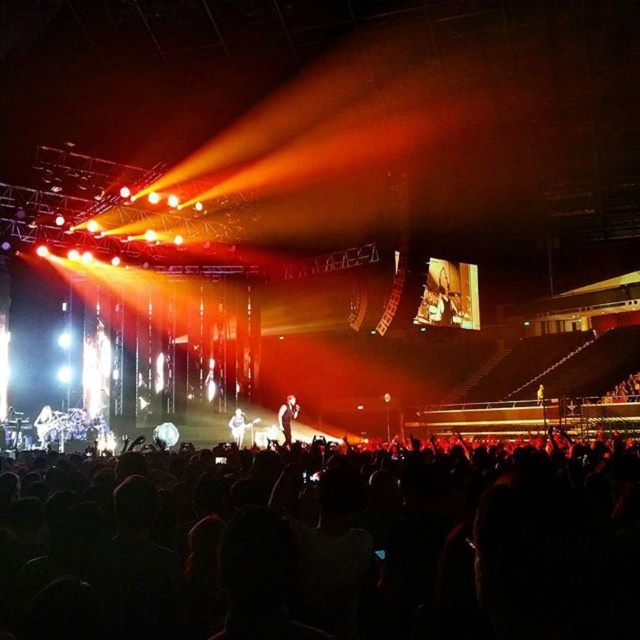
Between black matte crowd at lower center and yellow fabric person at center, which one is positioned lower?

Positioned lower is black matte crowd at lower center.

Is black matte crowd at lower center taller than yellow fabric person at center?

Yes, black matte crowd at lower center is taller than yellow fabric person at center.

Between point (204, 548) and point (538, 401), which one is positioned in front?

Positioned in front is point (204, 548).

You are a GUI agent. You are given a task and a screenshot of the screen. Output one action in this format:
    pyautogui.click(x=<x>, y=<y>)
    Task: Click on the black matte crowd at lower center
    This screenshot has height=640, width=640.
    Given the screenshot: What is the action you would take?
    pyautogui.click(x=323, y=547)

Does point (241, 424) come in front of point (540, 385)?

Yes.

What do you see at coordinates (240, 426) in the screenshot?
I see `white fabric shirt at center` at bounding box center [240, 426].

Identify the location of white fabric shirt at center. (240, 426).

Find the location of a particular element. This screenshot has width=640, height=640. white fabric shirt at center is located at coordinates (240, 426).

Who is more distant from viewer, (285, 422) or (538, 401)?

Point (538, 401)

Is black leather jacket at center wider than yellow fabric person at center?

No.

Based on the photo, who is more forward, (x=285, y=442) or (x=538, y=388)?

Positioned in front is point (x=285, y=442).

In order to click on black leather jacket at center in this screenshot , I will do `click(288, 417)`.